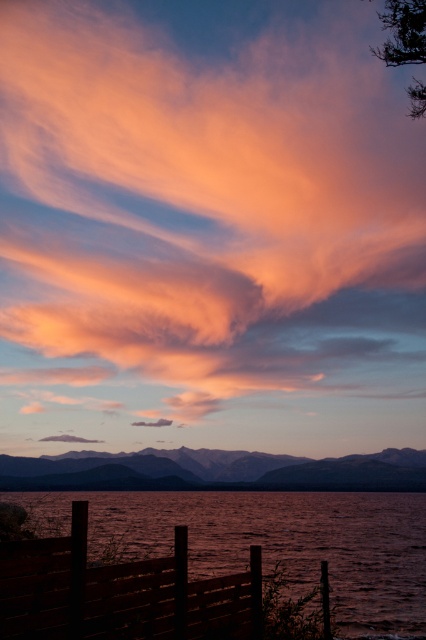
Question: Which point is closer to the camera?

Choices:
 (A) matte orange cloud at upper center
 (B) dull brown water at lower left

Answer: (B)

Question: Which point appears closest to the camera in this image?

Choices:
 (A) (284, 509)
 (B) (100, 17)

Answer: (A)

Question: Is matte orange cloud at upper center smaller than dull brown water at lower left?

Choices:
 (A) yes
 (B) no

Answer: (B)

Question: Is matte orange cloud at upper center thinner than dull brown water at lower left?

Choices:
 (A) no
 (B) yes

Answer: (A)

Question: Does matte orange cloud at upper center appear under dull brown water at lower left?

Choices:
 (A) yes
 (B) no

Answer: (B)